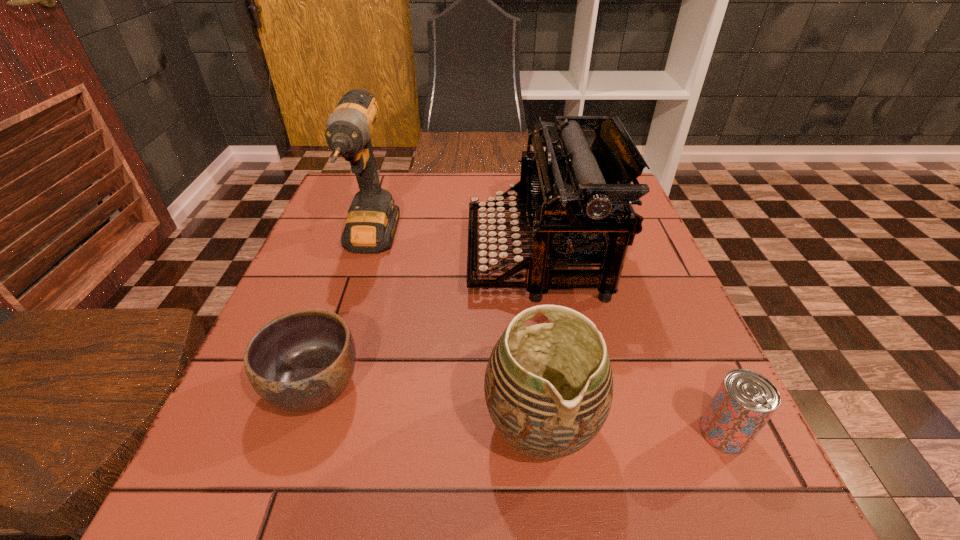
Image resolution: width=960 pixels, height=540 pixels. What are the coordinates of `drill` in the screenshot? It's located at (372, 219).

I want to click on the fourth shortest object, so click(x=576, y=196).

You are a GUI agent. You are given a task and a screenshot of the screen. Output one action in this format:
    pyautogui.click(x=<x>, y=<y>)
    Task: Click on the third tallest object
    This screenshot has width=960, height=540.
    Given the screenshot: What is the action you would take?
    pyautogui.click(x=548, y=387)

I want to click on bowl, so click(x=301, y=361).

The width and height of the screenshot is (960, 540). What are the coordinates of `beer can` in the screenshot? It's located at (744, 402).

Find the location of a particular element. vacant area located with the drill bit of the drill facing forward is located at coordinates pos(336,353).

Locate an element on the screen. free space located on the typing side of the fourth shortest object is located at coordinates 335,255.

I want to click on free spot located 0.270m on the typing side of the fourth shortest object, so click(x=348, y=255).

This screenshot has height=540, width=960. What are the coordinates of `free location located 0.340m on the typing side of the fourth shortest object` in the screenshot? It's located at (317, 255).

Where is `free region located on the back of the third shortest object`? free region located on the back of the third shortest object is located at coordinates (521, 250).